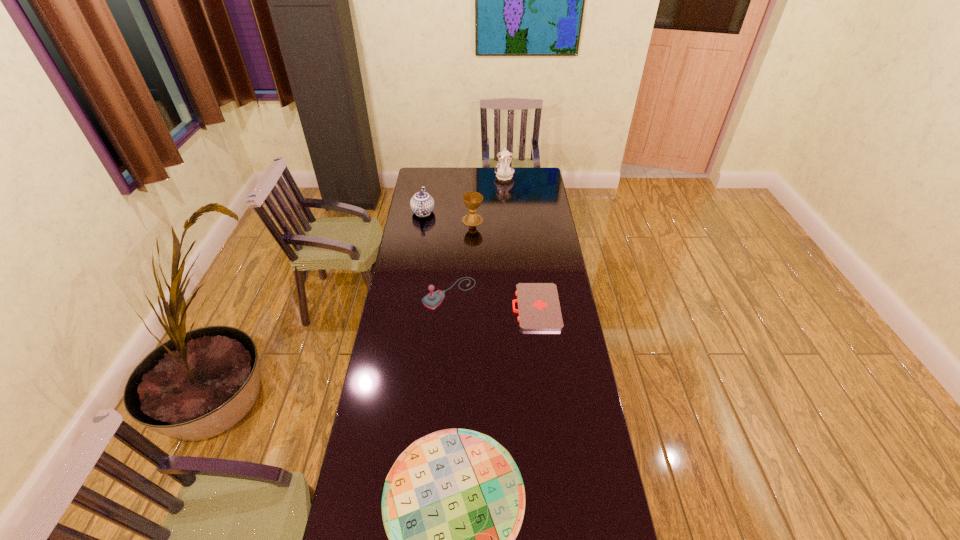
This screenshot has height=540, width=960. I want to click on free space that satisfies the following two spatial constraints: 1. on the back side of the chalice; 2. on the left side of the taller chinaware, so click(473, 177).